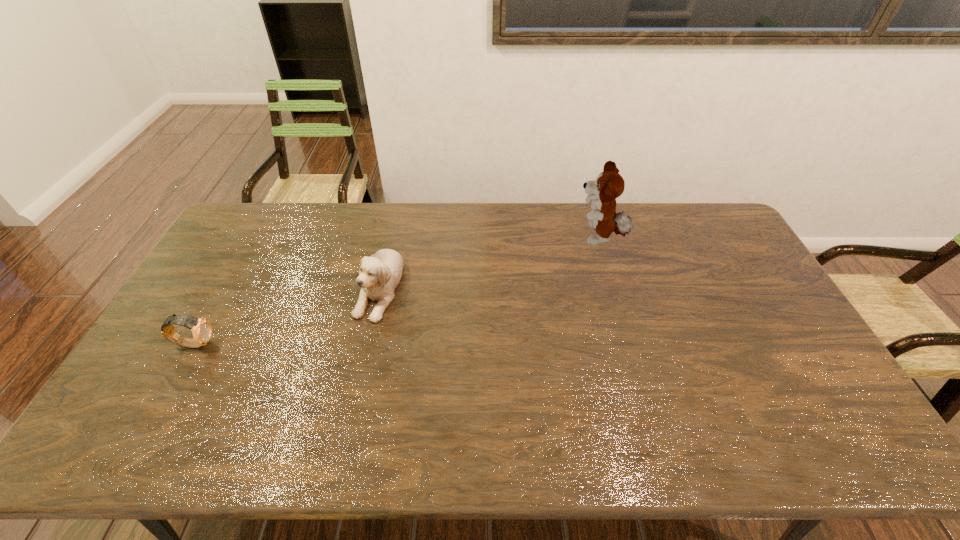
What are the coordinates of `object identified as the closest to the tallest object` in the screenshot? It's located at (379, 275).

Locate an element on the screen. This screenshot has height=540, width=960. free space in the image that satisfies the following two spatial constraints: 1. on the face of the taller puppy; 2. on the front-facing side of the second object from left to right is located at coordinates (613, 287).

Where is `free point that satisfies the following two spatial constraints: 1. on the face of the tallest object; 2. on the front-facing side of the second tallest object`? This screenshot has width=960, height=540. free point that satisfies the following two spatial constraints: 1. on the face of the tallest object; 2. on the front-facing side of the second tallest object is located at coordinates pos(613,287).

Locate an element on the screen. free spot that satisfies the following two spatial constraints: 1. on the front-facing side of the second tallest object; 2. on the face of the leftmost object is located at coordinates (366, 343).

In order to click on free location that satisfies the following two spatial constraints: 1. on the front-facing side of the left puppy; 2. on the face of the leftmost object in this screenshot , I will do `click(366, 343)`.

Where is `vacant area that satisfies the following two spatial constraints: 1. on the face of the taller puppy; 2. on the front-facing side of the shorter puppy`? The height and width of the screenshot is (540, 960). vacant area that satisfies the following two spatial constraints: 1. on the face of the taller puppy; 2. on the front-facing side of the shorter puppy is located at coordinates (613, 287).

At what (x,y) coordinates should I click in order to perform the action: click on free space in the image that satisfies the following two spatial constraints: 1. on the face of the rightmost object; 2. on the front-facing side of the second shortest object. Please return your answer as a coordinate pair (x, y). Image resolution: width=960 pixels, height=540 pixels. Looking at the image, I should click on (613, 287).

Locate an element on the screen. The height and width of the screenshot is (540, 960). blank space that satisfies the following two spatial constraints: 1. on the face of the tallest object; 2. on the front-facing side of the second object from right to left is located at coordinates (613, 287).

This screenshot has height=540, width=960. I want to click on vacant position in the image that satisfies the following two spatial constraints: 1. on the face of the tallest object; 2. on the front-facing side of the second tallest object, so click(x=613, y=287).

Locate an element on the screen. free region that satisfies the following two spatial constraints: 1. on the face of the taller puppy; 2. on the front-facing side of the second object from right to left is located at coordinates (613, 287).